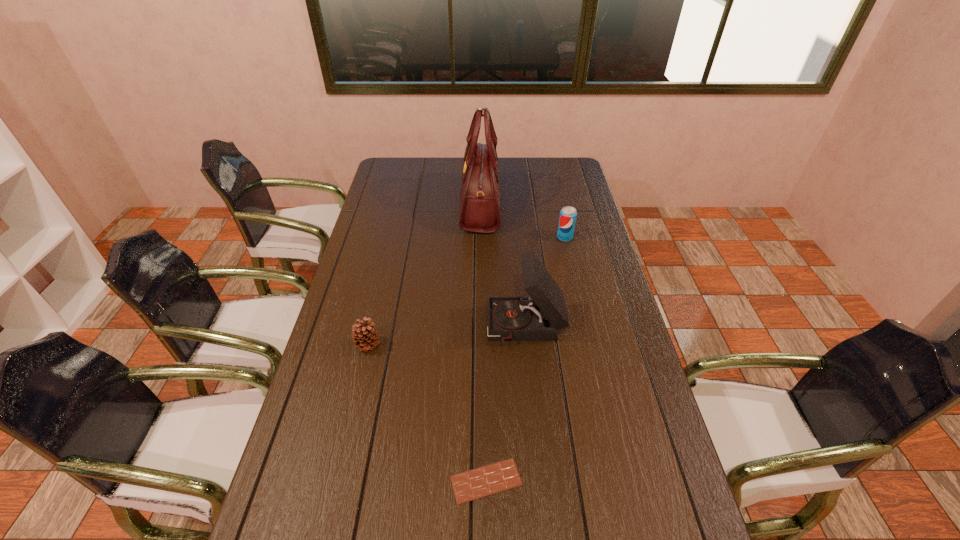
The width and height of the screenshot is (960, 540). In order to click on vacant space located on the front-facing side of the fourth shortest object in this screenshot , I will do `click(401, 328)`.

Where is `free space located 0.130m on the front-facing side of the fourth shortest object`? Image resolution: width=960 pixels, height=540 pixels. free space located 0.130m on the front-facing side of the fourth shortest object is located at coordinates [445, 328].

The image size is (960, 540). In order to click on free region located 0.170m on the left of the soda can in this screenshot , I will do `click(513, 238)`.

I want to click on vacant position located 0.210m on the front of the leftmost object, so click(350, 421).

Image resolution: width=960 pixels, height=540 pixels. Identify the location of vacant space located on the right of the chocolate bar. (569, 481).

Locate an element on the screen. Image resolution: width=960 pixels, height=540 pixels. object located in the far edge section of the desktop is located at coordinates (480, 194).

This screenshot has height=540, width=960. In order to click on object at the left edge in this screenshot , I will do `click(364, 336)`.

At what (x,y) coordinates should I click in order to perform the action: click on object that is at the right edge. Please return your answer as a coordinate pair (x, y). The height and width of the screenshot is (540, 960). Looking at the image, I should click on (568, 214).

Identify the location of vacant space at the far edge of the desktop. This screenshot has height=540, width=960. (420, 165).

The height and width of the screenshot is (540, 960). I want to click on blank space at the left edge of the desktop, so click(287, 472).